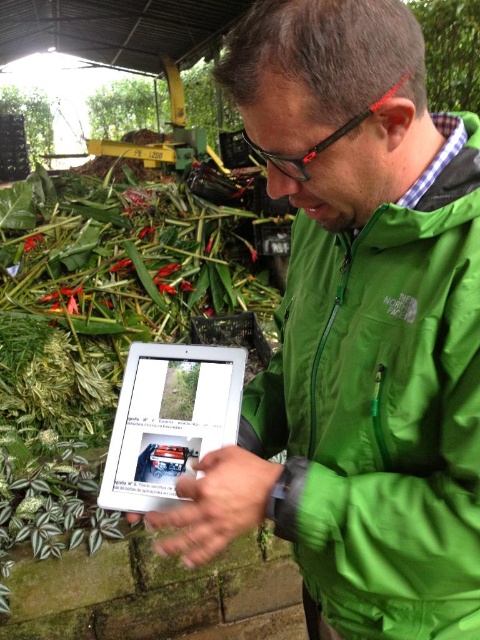
You are a farmer who needs to determine which object is taller between the green leafy plant at center and the silver metallic tablet at center. Based on the scene, which one is taller?

The green leafy plant at center is taller than the silver metallic tablet at center according to the description.

You are a farmer who needs to identify which object is shorter between the green fabric jacket at center and the green leafy plant at center. Based on the scene description, which one is shorter?

The green fabric jacket at center has a lesser height compared to the green leafy plant at center, so the green fabric jacket at center is shorter.

You are a delivery robot with a 10 inch wide package. You need to move from the green fabric jacket at center to the silver metallic tablet at center. Can you fit through the space between them?

The distance between the green fabric jacket at center and the silver metallic tablet at center is 7.97 inches. Since your package is 10 inches wide, it cannot fit through the space between them.